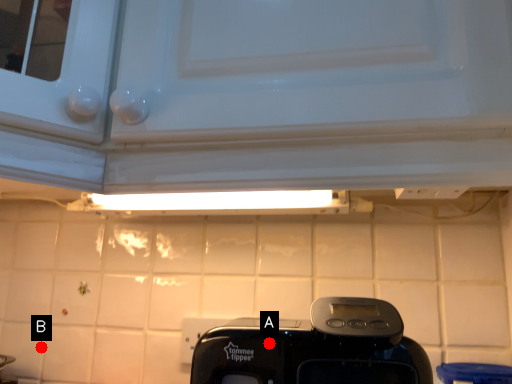
Question: Two points are circled on the image, labeled by A and B beside each circle. Which point appears farthest from the camera in this image?

Choices:
 (A) A is further
 (B) B is further

Answer: (B)